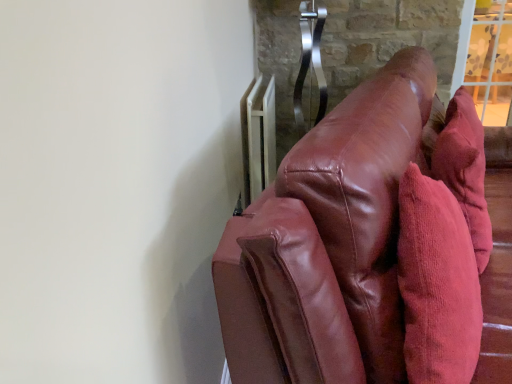
Question: From the image's perspective, is white metallic radiator at upper right located above or below shiny brown leather couch at right?

Choices:
 (A) below
 (B) above

Answer: (B)

Question: Visually, is white metallic radiator at upper right positioned to the left or to the right of shiny brown leather couch at right?

Choices:
 (A) left
 (B) right

Answer: (A)

Question: Based on their relative distances, which object is nearer to the shiny brown leather couch at right?

Choices:
 (A) white metallic radiator at upper right
 (B) corduroy throw pillow at right

Answer: (B)

Question: Considering the real-world distances, which object is farthest from the corduroy throw pillow at right?

Choices:
 (A) shiny brown leather couch at right
 (B) white metallic radiator at upper right

Answer: (B)